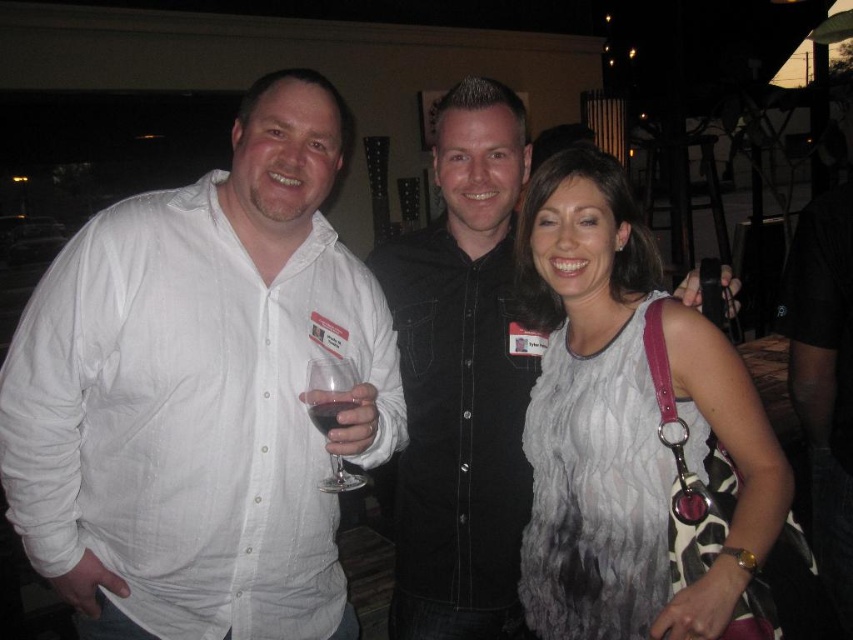
Question: Estimate the real-world distances between objects in this image. Which object is closer to the dark red liquid at center?

Choices:
 (A) white textured dress at center
 (B) transparent glass at center
 (C) white linen shirt at left

Answer: (B)

Question: Observing the image, what is the correct spatial positioning of white linen shirt at left in reference to white textured dress at center?

Choices:
 (A) right
 (B) left

Answer: (B)

Question: Can you confirm if white linen shirt at left is bigger than transparent glass at center?

Choices:
 (A) yes
 (B) no

Answer: (A)

Question: Can you confirm if transparent glass at center is positioned to the left of dark red liquid at center?

Choices:
 (A) no
 (B) yes

Answer: (B)

Question: Based on their relative distances, which object is nearer to the white linen shirt at left?

Choices:
 (A) transparent glass at center
 (B) white textured dress at center
 (C) dark red liquid at center

Answer: (A)

Question: Which object is farther from the camera taking this photo?

Choices:
 (A) white linen shirt at left
 (B) dark red liquid at center
 (C) white textured dress at center
 (D) transparent glass at center

Answer: (A)